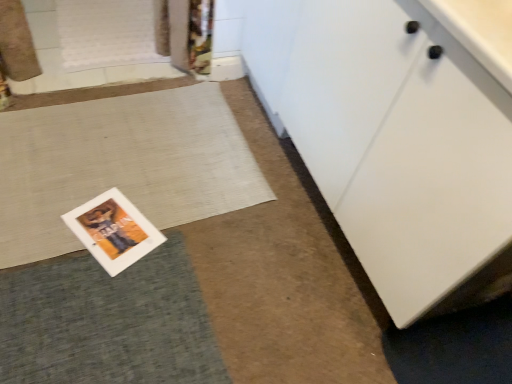
Identify the location of vacant region above white paper postcard at lower left (from a real-world perspective). (96, 223).